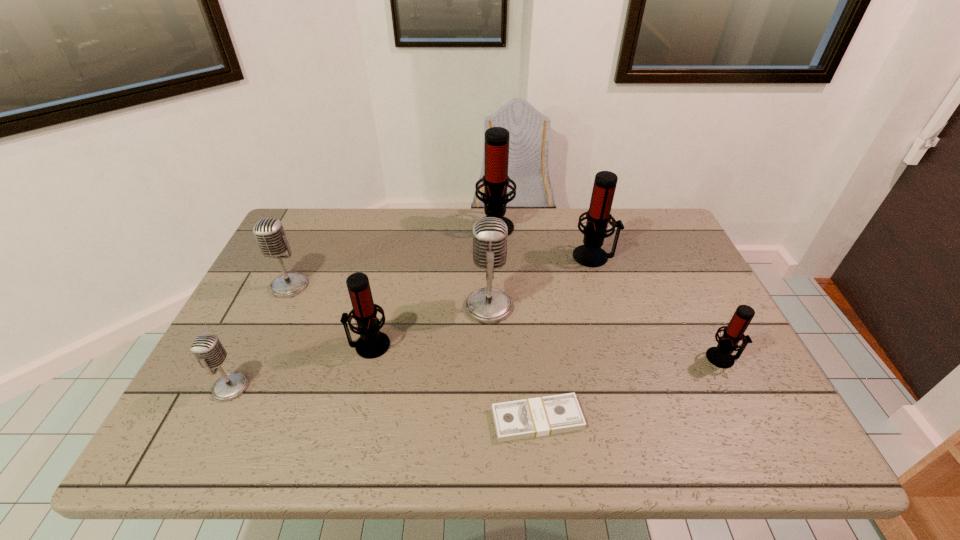
Locate an element on the screen. This screenshot has height=540, width=960. the nearest gray microphone is located at coordinates (207, 349).

Identify the location of the nearest microphone. This screenshot has height=540, width=960. [207, 349].

What are the coordinates of `the shortest object` in the screenshot? It's located at (541, 416).

What are the coordinates of `vacant space located on the front of the farthest red microphone` in the screenshot? It's located at (498, 303).

I want to click on vacant region located 0.200m on the back of the seventh object from left to right, so click(x=580, y=210).

The width and height of the screenshot is (960, 540). I want to click on free region located on the left of the biggest gray microphone, so coord(328,307).

The height and width of the screenshot is (540, 960). What are the coordinates of `vacant space located on the back of the second smallest gray microphone` in the screenshot? It's located at [324, 211].

Find the location of a particular element. Image resolution: width=960 pixels, height=540 pixels. vacant space located 0.080m on the right of the leftmost red microphone is located at coordinates (423, 345).

At what (x,y) coordinates should I click in order to perform the action: click on free spot located on the back of the rightmost microphone. Please return your answer as a coordinate pair (x, y). This screenshot has width=960, height=540. Looking at the image, I should click on (683, 278).

The image size is (960, 540). What are the coordinates of `free region located 0.150m on the back of the nearest gray microphone` in the screenshot? It's located at (262, 324).